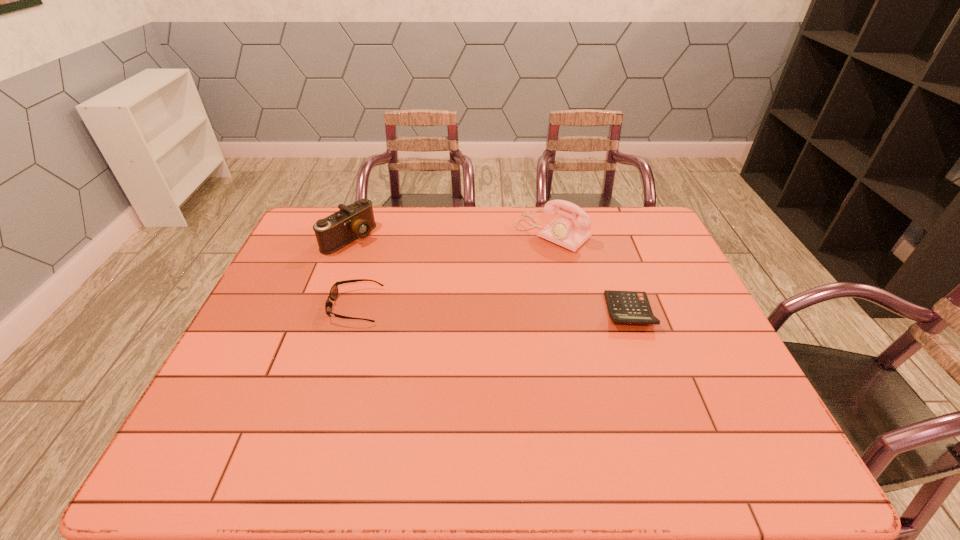
This screenshot has height=540, width=960. In order to click on vacant space that satisfies the following two spatial constraints: 1. on the front side of the tallest object; 2. on the left side of the calculator in this screenshot , I will do `click(569, 312)`.